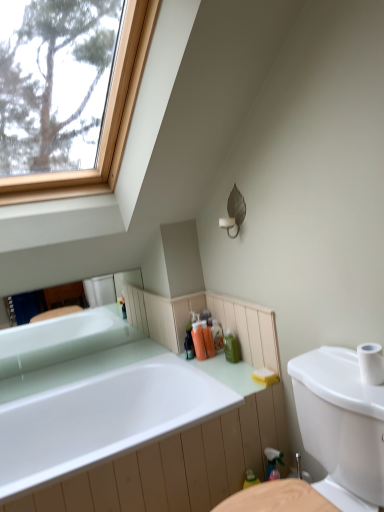
Where is `vacant space positioned to the left of translucent plastic bottles at center, the 4th toiletry positioned from the right`? vacant space positioned to the left of translucent plastic bottles at center, the 4th toiletry positioned from the right is located at coordinates (173, 362).